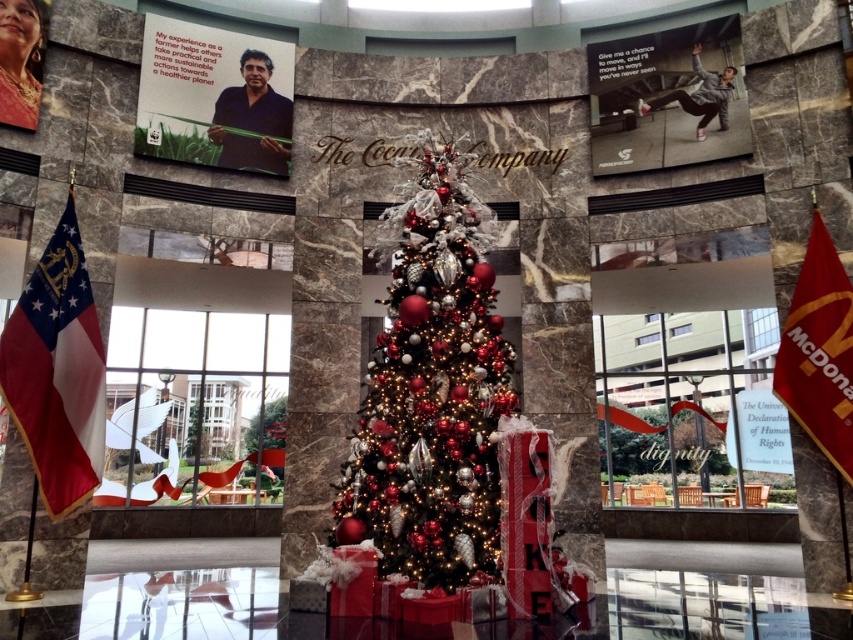
Question: Can you confirm if red-white flag at left is positioned below red fabric flag at right?

Choices:
 (A) no
 (B) yes

Answer: (B)

Question: Can you confirm if shiny metallic christmas tree at center is positioned to the left of red-white flag at left?

Choices:
 (A) no
 (B) yes

Answer: (A)

Question: Estimate the real-world distances between objects in this image. Which object is closer to the shiny metallic christmas tree at center?

Choices:
 (A) red-white flag at left
 (B) red fabric flag at right

Answer: (A)

Question: Among these points, which one is farthest from the camera?

Choices:
 (A) (35, 305)
 (B) (393, 275)
 (C) (827, 424)

Answer: (C)

Question: Which object appears closest to the camera in this image?

Choices:
 (A) shiny metallic christmas tree at center
 (B) red fabric flag at right

Answer: (A)

Question: Can you confirm if shiny metallic christmas tree at center is bigger than red fabric flag at right?

Choices:
 (A) yes
 (B) no

Answer: (A)